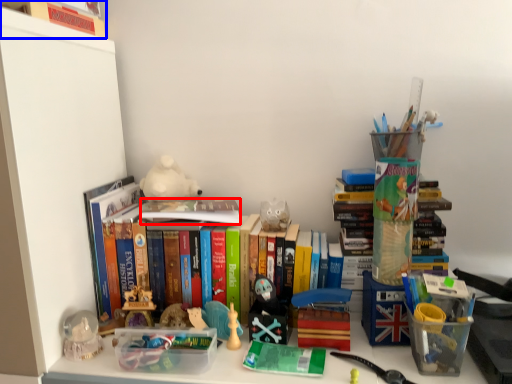
Question: Which point is further to the camera, book (highlighted by a red box) or book (highlighted by a blue box)?

Choices:
 (A) book
 (B) book

Answer: (A)